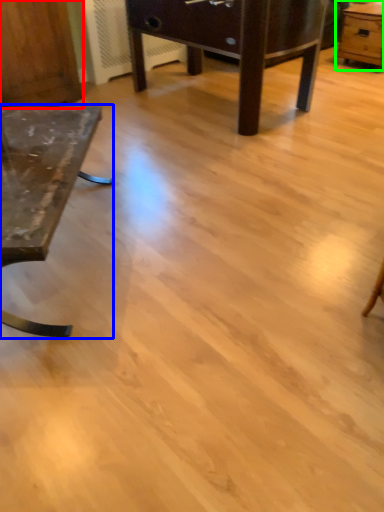
Question: Based on their relative distances, which object is farther from dresser (highlighted by a red box)? Choose from table (highlighted by a blue box) and table (highlighted by a green box).

Choices:
 (A) table
 (B) table

Answer: (B)